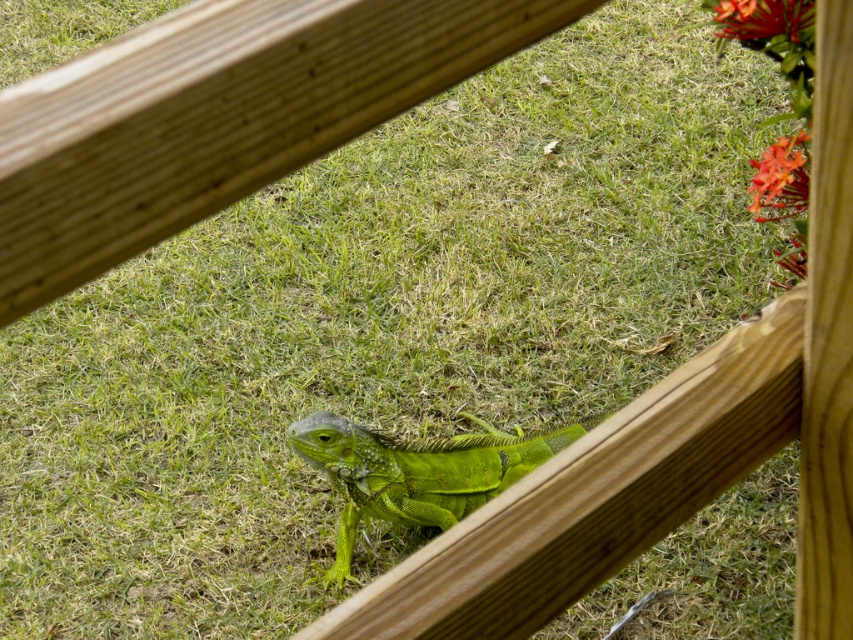
Who is shorter, green scaly lizard at center or orange matte flower at upper right?

With less height is orange matte flower at upper right.

This screenshot has height=640, width=853. In order to click on green scaly lizard at center in this screenshot , I will do `click(415, 472)`.

The width and height of the screenshot is (853, 640). I want to click on green scaly lizard at center, so click(415, 472).

Does light brown wooden rail at center have a greater width compared to orange glossy flower at upper right?

Yes, light brown wooden rail at center is wider than orange glossy flower at upper right.

Can you confirm if light brown wooden rail at center is positioned to the right of orange glossy flower at upper right?

Incorrect, light brown wooden rail at center is not on the right side of orange glossy flower at upper right.

What do you see at coordinates (218, 116) in the screenshot?
I see `light brown wooden rail at center` at bounding box center [218, 116].

The image size is (853, 640). I want to click on light brown wooden rail at center, so click(218, 116).

Does light brown wooden rail at center appear under green scaly lizard at center?

No, light brown wooden rail at center is not below green scaly lizard at center.

Measure the distance between light brown wooden rail at center and camera.

The distance of light brown wooden rail at center from camera is 22.84 inches.

Measure the distance between point (148, 104) and camera.

A distance of 24.78 inches exists between point (148, 104) and camera.

Identify the location of light brown wooden rail at center. The height and width of the screenshot is (640, 853). 218,116.